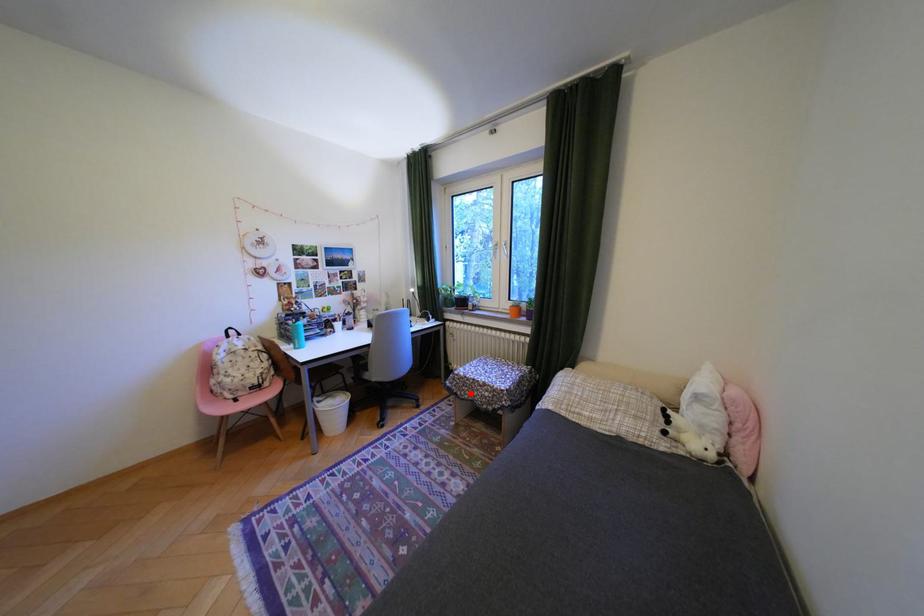
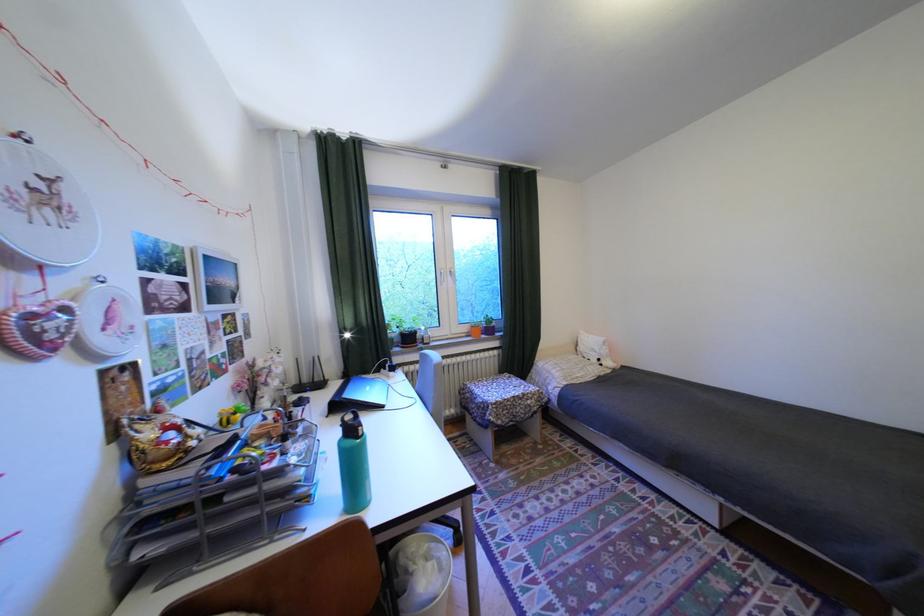
In the second image, find the point that corresponds to the highlighted location in the first image.

(512, 422)